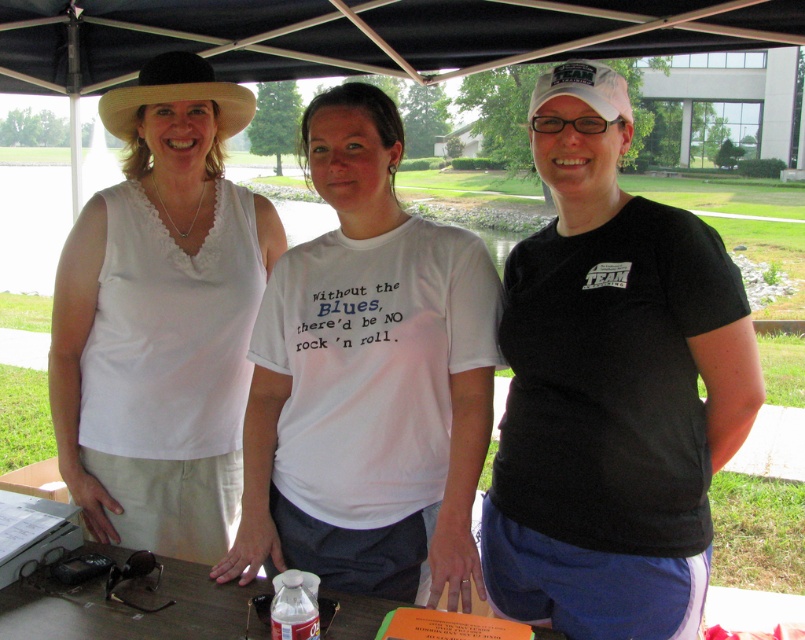
You are a photographer trying to capture a clear shot of the white fabric tank top at left and the black felt cowboy hat at upper left. Which object should you focus on first to ensure it appears sharp in the photo?

You should focus on the white fabric tank top at left first because it is closer to the viewer than the black felt cowboy hat at upper left, so it requires proper focus to ensure sharpness.